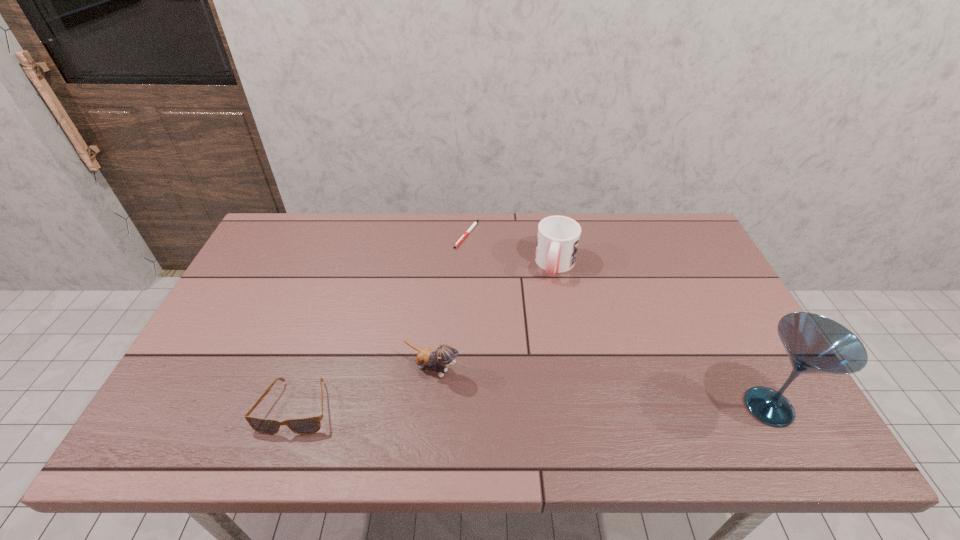
Where is `the fourth closest object to the third tallest object`? Image resolution: width=960 pixels, height=540 pixels. the fourth closest object to the third tallest object is located at coordinates (815, 344).

The width and height of the screenshot is (960, 540). What are the coordinates of `object that is the second closest to the shortest object` in the screenshot? It's located at coord(444,356).

The width and height of the screenshot is (960, 540). I want to click on vacant area that satisfies the following two spatial constraints: 1. on the front side of the rightmost object; 2. on the left side of the kitten, so click(x=428, y=407).